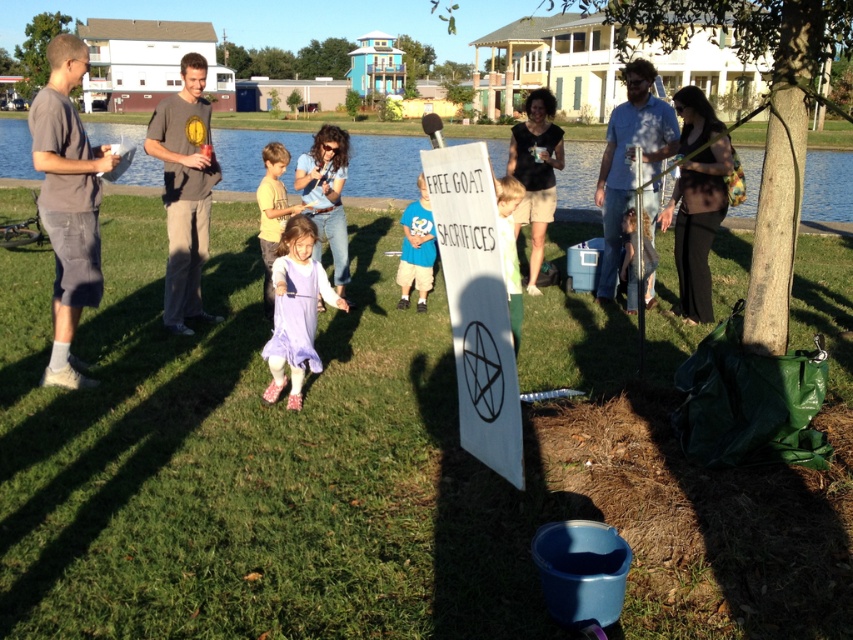
Question: Which of the following is the closest to the observer?

Choices:
 (A) light brown hair at center
 (B) blue cotton shirt at center
 (C) blue water at lake left
 (D) blue denim shirt at center

Answer: (A)

Question: Is white paper sign at center to the left of matte gray t-shirt at left from the viewer's perspective?

Choices:
 (A) yes
 (B) no

Answer: (B)

Question: Among these objects, which one is nearest to the camera?

Choices:
 (A) matte gray t-shirt at left
 (B) gray cotton t-shirt at center
 (C) blue denim shirt at center

Answer: (A)

Question: Can you confirm if matte gray t-shirt at left is positioned below gray cotton t-shirt at center?

Choices:
 (A) yes
 (B) no

Answer: (B)

Question: Does purple fabric dress at center have a lesser width compared to light brown hair at center?

Choices:
 (A) no
 (B) yes

Answer: (A)

Question: Which of the following is the farthest from the observer?

Choices:
 (A) matte gray t-shirt at left
 (B) blue cotton shirt at center
 (C) lavender fabric dress at center
 (D) gray cotton t-shirt at left

Answer: (B)